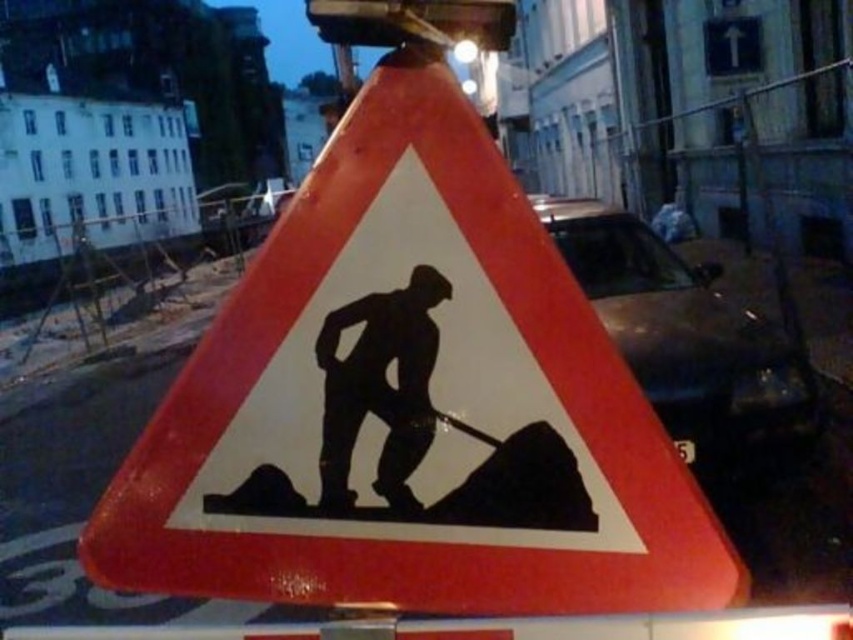
You are driving a car and see the reflective plastic construction sign at center ahead. Based on its position, can you estimate if it is placed on the left or right side of the road?

The reflective plastic construction sign at center is located at point coordinates that are not directly indicative of left or right placement without additional context about the road layout. However, since it is at the center, it is likely positioned in the middle of the road, not to the left or right side.

You are driving at night and see the reflective plastic construction sign at center and the black silhouette at center. Which object will be more visible to you in the dark?

The reflective plastic construction sign at center will be more visible in the dark because it is made of reflective material, while the black silhouette at center is not described as reflective.